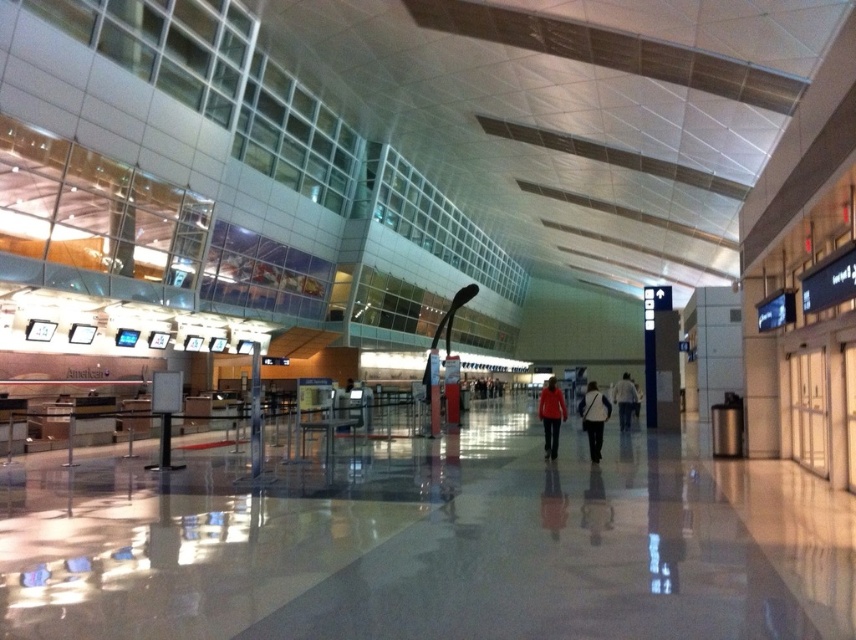
Is matte red jacket at center further to the viewer compared to light blue jeans at center?

No, matte red jacket at center is closer to the viewer.

Looking at this image, can you confirm if matte red jacket at center is wider than light blue jeans at center?

No.

Who is more distant from viewer, (551, 428) or (627, 429)?

Point (627, 429)

Identify the location of matte red jacket at center. The height and width of the screenshot is (640, 856). [551, 416].

Can you confirm if white fabric bag at center is bigger than light blue jeans at center?

Yes.

Does point (599, 412) lie behind point (625, 381)?

No, (599, 412) is closer to viewer.

What are the coordinates of `white fabric bag at center` in the screenshot? It's located at (593, 419).

Is white fabric bag at center to the right of matte red jacket at center from the viewer's perspective?

Correct, you'll find white fabric bag at center to the right of matte red jacket at center.

What do you see at coordinates (593, 419) in the screenshot? I see `white fabric bag at center` at bounding box center [593, 419].

You are a GUI agent. You are given a task and a screenshot of the screen. Output one action in this format:
    pyautogui.click(x=<x>, y=<y>)
    Task: Click on the white fabric bag at center
    This screenshot has width=856, height=640.
    Given the screenshot: What is the action you would take?
    pyautogui.click(x=593, y=419)